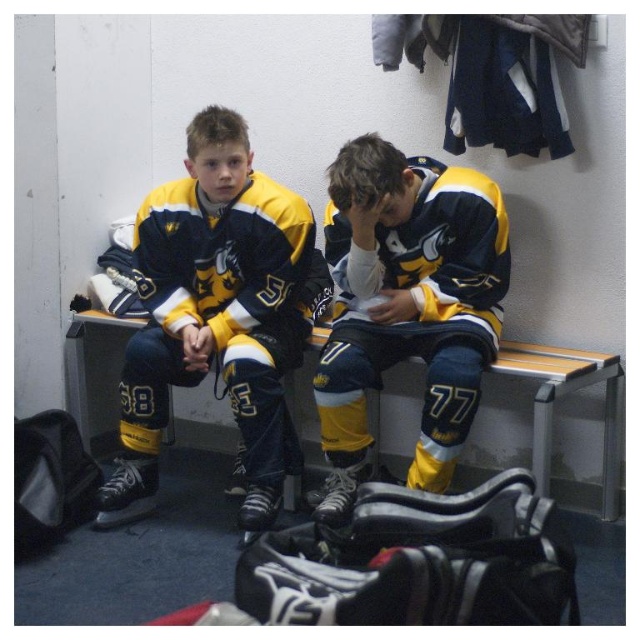
You are a team manager who needs to arrange the hockey jerseys on a display rack. The rack has two hooks at the same height. You have the matte hockey jersey at center and the matte yellow hockey jersey at center. Which jersey should you hang on the hook that is to the left to ensure they are displayed properly according to their sizes?

The matte hockey jersey at center is taller than the matte yellow hockey jersey at center, so you should hang the matte hockey jersey at center on the left hook to display the larger jersey first.

You are a team manager trying to organize the jerseys in a display case. The display case has a shelf that can only accommodate items up to the width of the matte yellow hockey jersey at center. Can the matte hockey jersey at center fit on this shelf?

The matte hockey jersey at center is wider than the matte yellow hockey jersey at center, so it cannot fit on the shelf designed for the smaller width.